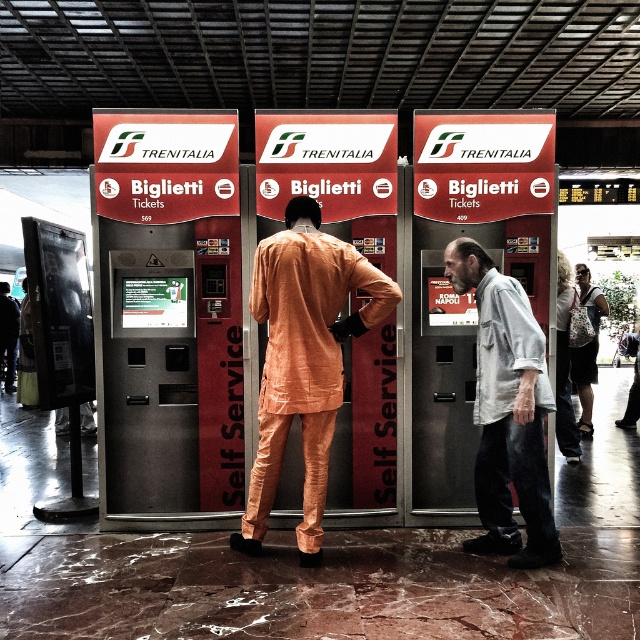
Question: Does red plastic vending machine at center have a smaller size compared to light gray cotton shirt at right?

Choices:
 (A) no
 (B) yes

Answer: (B)

Question: Is metallic silver ticket machine at center smaller than light gray cotton shirt at right?

Choices:
 (A) no
 (B) yes

Answer: (B)

Question: Which of these objects is positioned farthest from the metallic silver ticket machine at center?

Choices:
 (A) red plastic vending machine at center
 (B) orange fabric suit at center

Answer: (A)

Question: Which object appears farthest from the camera in this image?

Choices:
 (A) orange fabric suit at center
 (B) red plastic vending machine at center
 (C) metallic silver ticket machine at center
 (D) light gray cotton shirt at right

Answer: (B)

Question: Which point is closer to the camera taking this photo?

Choices:
 (A) [x=412, y=413]
 (B) [x=202, y=355]
 (C) [x=486, y=470]

Answer: (C)

Question: Is metallic silver ticket machine at center smaller than light gray cotton shirt at right?

Choices:
 (A) no
 (B) yes

Answer: (B)